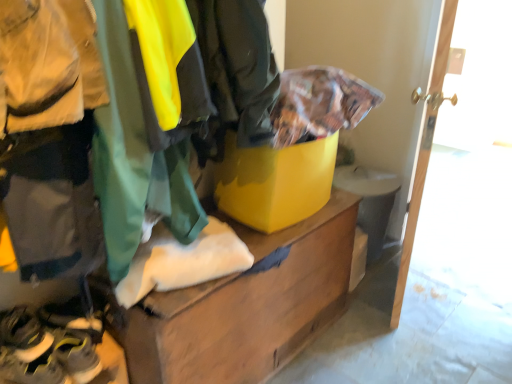
Question: Can you confirm if yellow matte cardboard box at center is shorter than wooden door at right?

Choices:
 (A) yes
 (B) no

Answer: (A)

Question: Considering the relative positions of yellow matte cardboard box at center and wooden door at right in the image provided, is yellow matte cardboard box at center to the right of wooden door at right from the viewer's perspective?

Choices:
 (A) no
 (B) yes

Answer: (A)

Question: Considering the relative sizes of yellow matte cardboard box at center and wooden door at right in the image provided, is yellow matte cardboard box at center smaller than wooden door at right?

Choices:
 (A) yes
 (B) no

Answer: (A)

Question: Is yellow matte cardboard box at center placed right next to wooden door at right?

Choices:
 (A) yes
 (B) no

Answer: (B)

Question: Is yellow matte cardboard box at center not inside wooden door at right?

Choices:
 (A) yes
 (B) no

Answer: (A)

Question: From a real-world perspective, is yellow rubber shoes at lower left, which appears as the second footwear when ordered from the bottom, physically located above or below wooden chest at center?

Choices:
 (A) below
 (B) above

Answer: (B)

Question: From the image's perspective, is yellow rubber shoes at lower left, which is the first footwear from top to bottom, located above or below wooden chest at center?

Choices:
 (A) below
 (B) above

Answer: (A)

Question: Looking at the image, does yellow rubber shoes at lower left, which is the first footwear from top to bottom, seem bigger or smaller compared to wooden chest at center?

Choices:
 (A) small
 (B) big

Answer: (A)

Question: Considering the positions of yellow rubber shoes at lower left, which appears as the second footwear when ordered from the bottom, and wooden chest at center in the image, is yellow rubber shoes at lower left, which appears as the second footwear when ordered from the bottom, taller or shorter than wooden chest at center?

Choices:
 (A) tall
 (B) short

Answer: (B)

Question: Would you say wooden door at right is to the left or to the right of wooden chest at center in the picture?

Choices:
 (A) right
 (B) left

Answer: (A)

Question: From the image's perspective, is wooden door at right above or below wooden chest at center?

Choices:
 (A) below
 (B) above

Answer: (B)

Question: Is wooden door at right wider or thinner than wooden chest at center?

Choices:
 (A) wide
 (B) thin

Answer: (B)

Question: Which is correct: wooden door at right is inside wooden chest at center, or outside of it?

Choices:
 (A) outside
 (B) inside

Answer: (A)

Question: Is yellow rubber shoes at lower left, which is the first footwear from top to bottom, spatially inside yellow matte cardboard box at center, or outside of it?

Choices:
 (A) outside
 (B) inside

Answer: (A)

Question: Considering the positions of yellow rubber shoes at lower left, which appears as the second footwear when ordered from the bottom, and yellow matte cardboard box at center in the image, is yellow rubber shoes at lower left, which appears as the second footwear when ordered from the bottom, taller or shorter than yellow matte cardboard box at center?

Choices:
 (A) tall
 (B) short

Answer: (B)